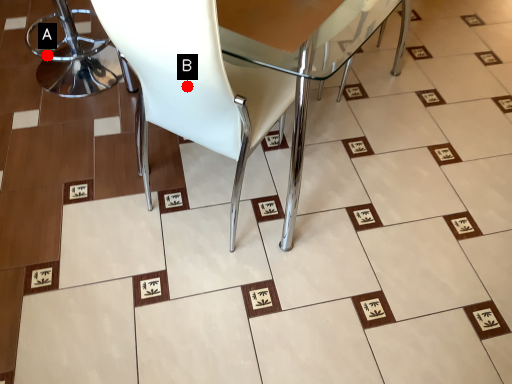
Question: Two points are circled on the image, labeled by A and B beside each circle. Which point appears closest to the camera in this image?

Choices:
 (A) A is closer
 (B) B is closer

Answer: (B)